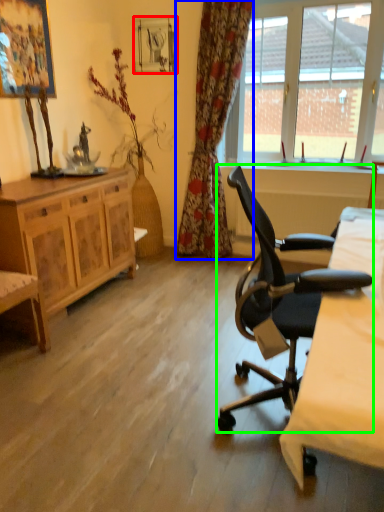
Question: Which object is positioned closest to picture frame (highlighted by a red box)? Select from curtain (highlighted by a blue box) and chair (highlighted by a green box).

Choices:
 (A) curtain
 (B) chair

Answer: (A)